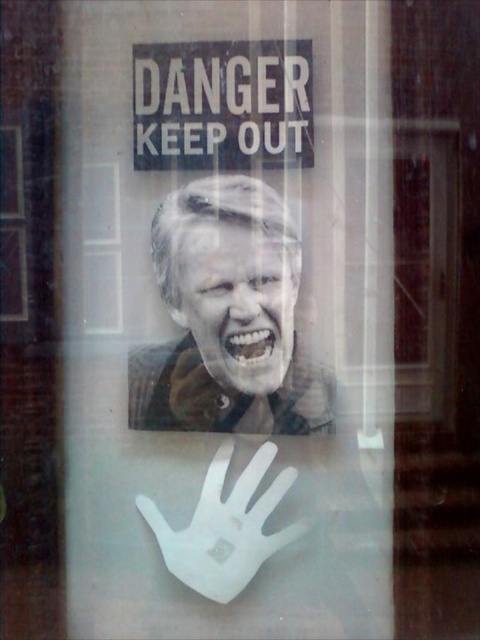
Question: Among these objects, which one is nearest to the camera?

Choices:
 (A) black plastic sign at upper center
 (B) smooth skin face at center
 (C) smooth brown leather jacket at center

Answer: (A)

Question: Does black plastic sign at upper center appear on the left side of smooth skin face at center?

Choices:
 (A) yes
 (B) no

Answer: (A)

Question: Which object is positioned farthest from the black plastic sign at upper center?

Choices:
 (A) white matte hand at lower center
 (B) smooth skin face at center

Answer: (A)

Question: Does black plastic sign at upper center appear on the right side of smooth skin face at center?

Choices:
 (A) yes
 (B) no

Answer: (B)

Question: Based on their relative distances, which object is nearer to the black plastic sign at upper center?

Choices:
 (A) white matte hand at lower center
 (B) smooth skin face at center
 (C) smooth brown leather jacket at center

Answer: (C)

Question: Is smooth skin face at center smaller than white matte hand at lower center?

Choices:
 (A) no
 (B) yes

Answer: (B)